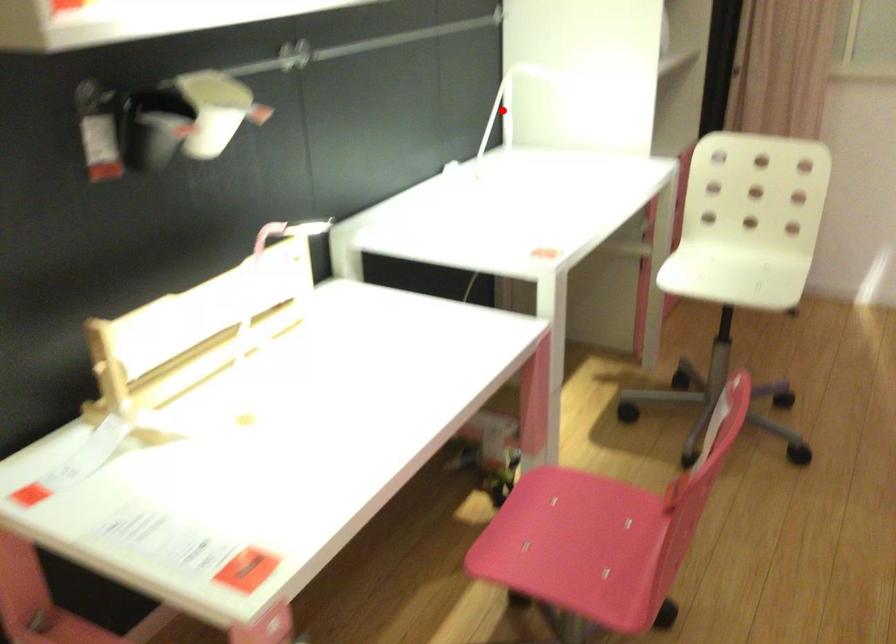
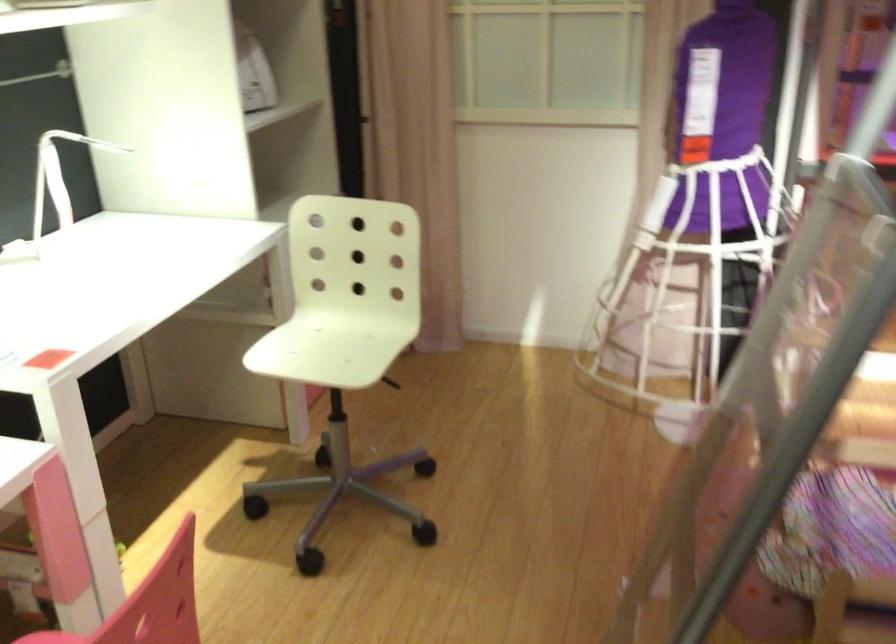
Locate, in the second image, the point that corresponds to the highlighted location in the first image.

(58, 176)